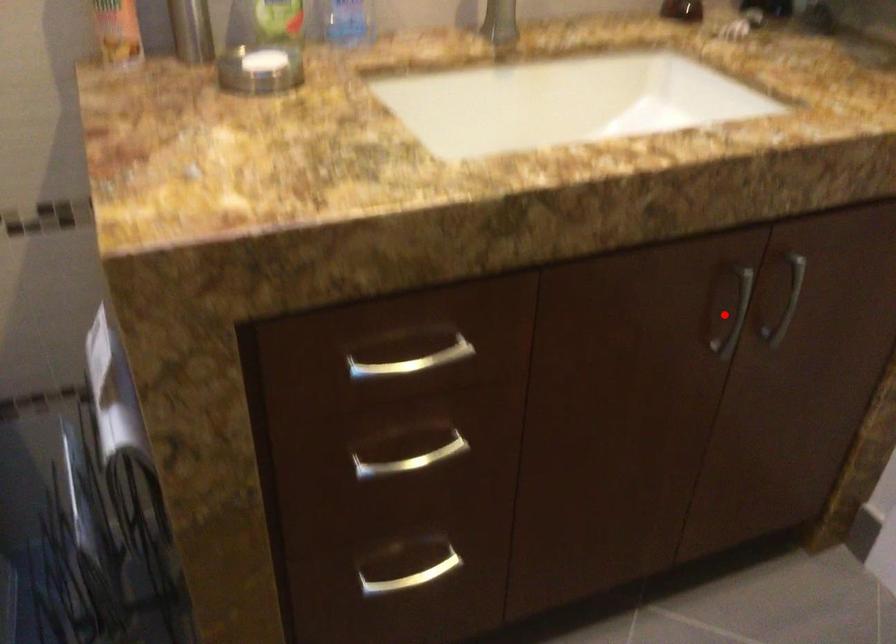
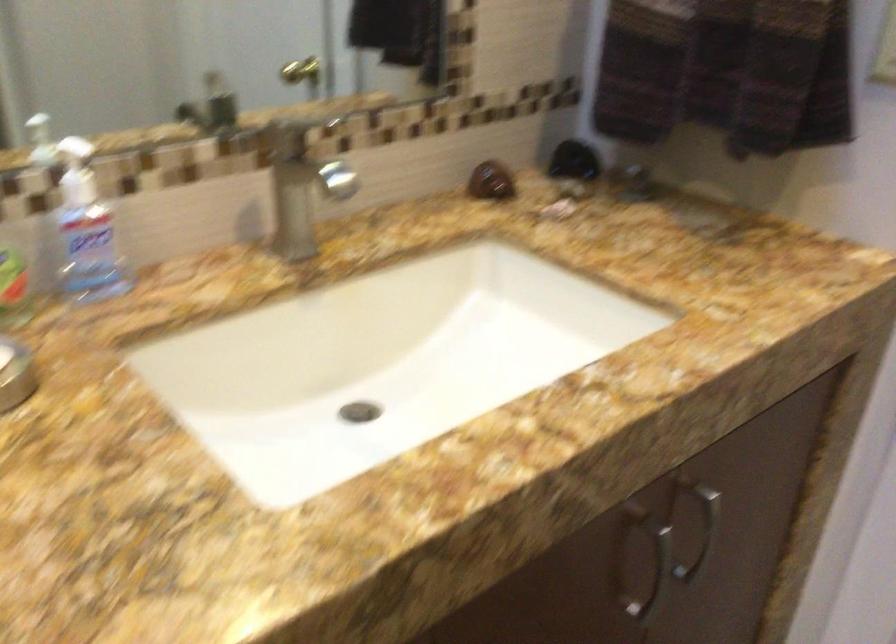
Find the pixel in the second image that matches the highlighted location in the first image.

(642, 565)